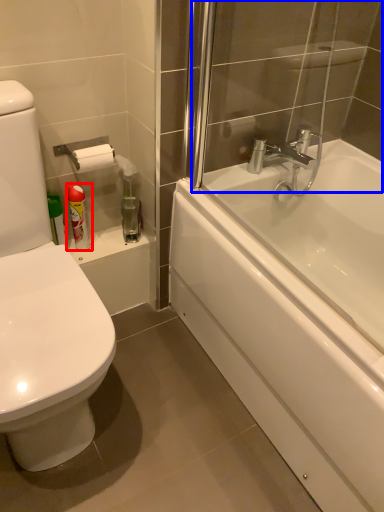
Question: Which of the following is the closest to the observer, toiletry (highlighted by a red box) or shower door (highlighted by a blue box)?

Choices:
 (A) toiletry
 (B) shower door

Answer: (B)